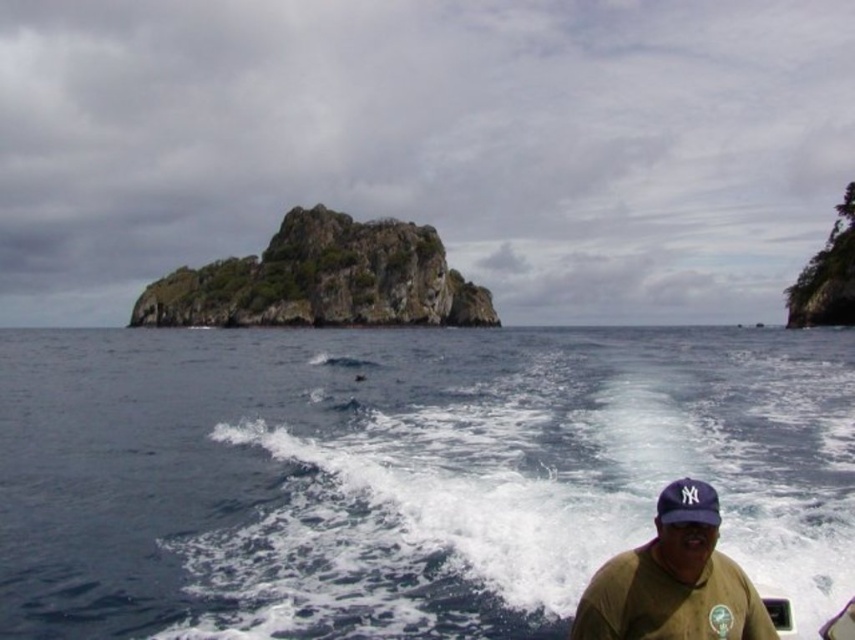
Can you confirm if rockymaterial/texture at center is taller than brown matte shirt at lower right?

Yes.

What do you see at coordinates (322, 280) in the screenshot?
I see `rockymaterial/texture at center` at bounding box center [322, 280].

Where is `rockymaterial/texture at center`? Image resolution: width=855 pixels, height=640 pixels. rockymaterial/texture at center is located at coordinates (322, 280).

Is blue water at center below rockymaterial/texture at center?

Yes, blue water at center is below rockymaterial/texture at center.

Looking at this image, between blue water at center and rockymaterial/texture at center, which one appears on the right side from the viewer's perspective?

Positioned to the right is blue water at center.

You are a GUI agent. You are given a task and a screenshot of the screen. Output one action in this format:
    pyautogui.click(x=<x>, y=<y>)
    Task: Click on the blue water at center
    
    Given the screenshot: What is the action you would take?
    pyautogui.click(x=402, y=474)

At what (x,y) coordinates should I click in order to perform the action: click on blue water at center. Please return your answer as a coordinate pair (x, y). Looking at the image, I should click on (402, 474).

Between blue water at center and brown matte shirt at lower right, which one has more height?

Standing taller between the two is blue water at center.

Between blue water at center and brown matte shirt at lower right, which one appears on the left side from the viewer's perspective?

From the viewer's perspective, blue water at center appears more on the left side.

Is point (28, 440) more distant than point (685, 637)?

Yes.

Identify the location of blue water at center. (402, 474).